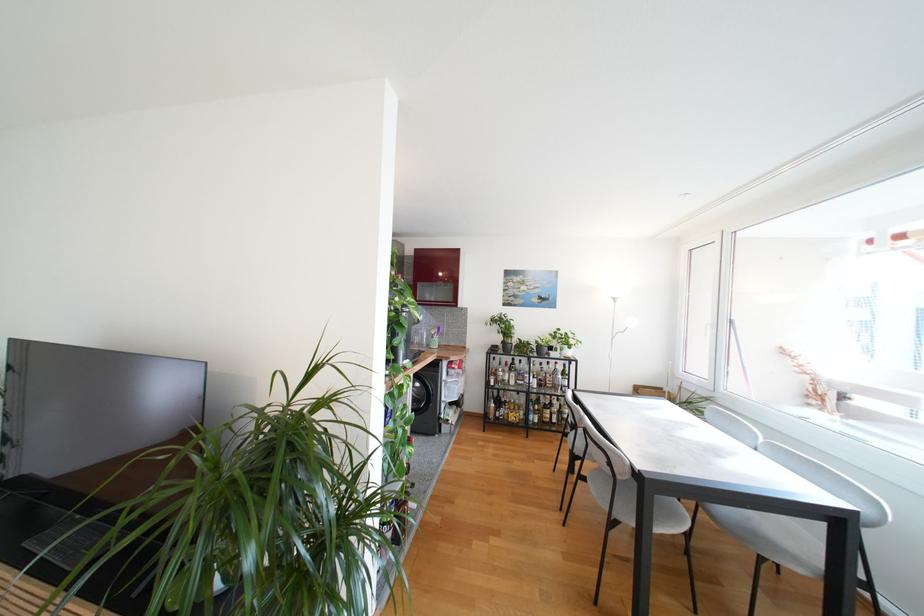
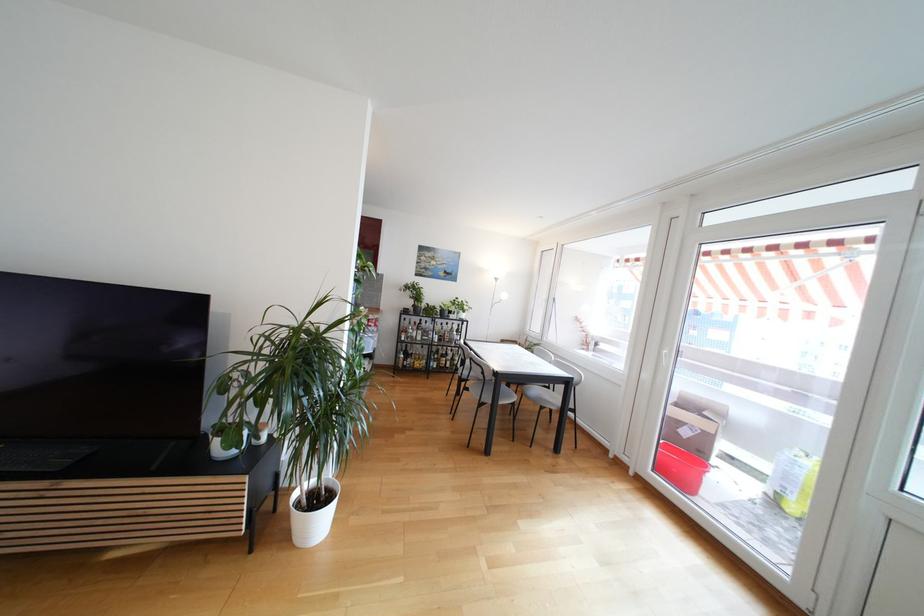
Locate, in the second image, the point that corresponds to (492,355) in the first image.

(405, 315)